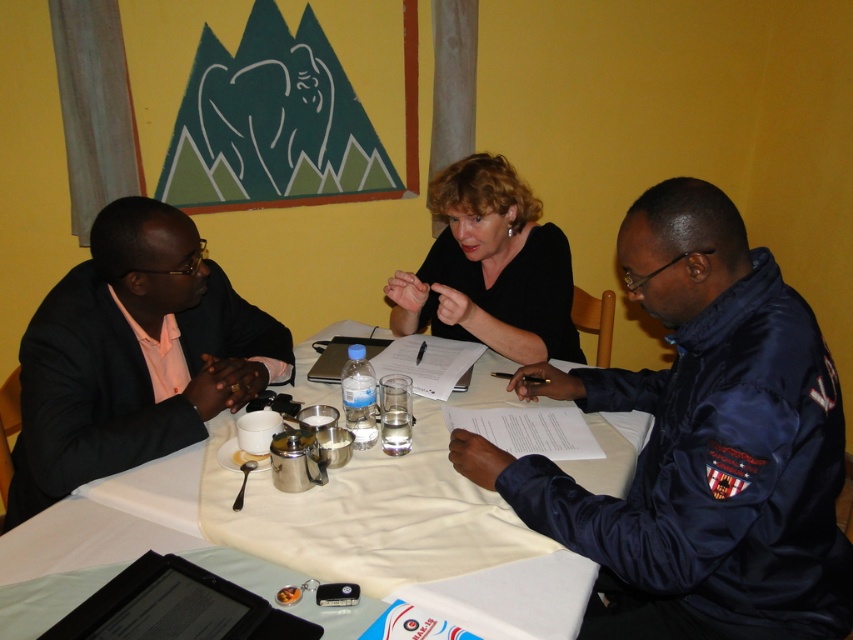
From the picture: You are standing at the edge of the table looking towards the center. There are two points marked on the table surface, point (537, 637) and point (466, 209). Which point is closer to you?

Point (537, 637) is closer to the viewer than point (466, 209).

You are a photographer setting up for a group photo. You notice the white cloth at center and the black matte shirt at center. Which object should you adjust to ensure both are fully visible in the frame?

The white cloth at center is not as tall as the black matte shirt at center. To ensure both are fully visible, you should adjust the angle or position so that the shorter white cloth at center is not obscured by the taller black matte shirt at center.

You are organizing a meeting and need to seat two participants wearing the navy blue uniform at center and the black matte shirt at center. If the table has limited space, which participant should you seat first to ensure both can fit comfortably?

The navy blue uniform at center has a larger size compared to the black matte shirt at center. Therefore, you should seat the participant in the navy blue uniform at center first to accommodate their larger size, ensuring there is enough space left for the black matte shirt at center.